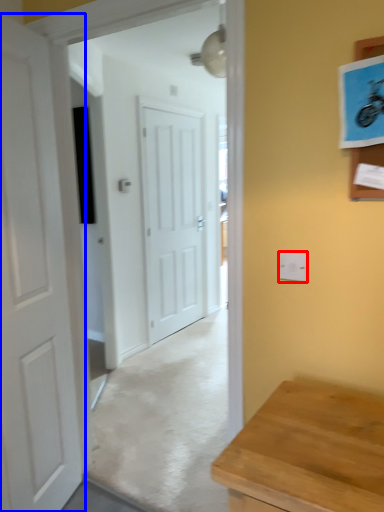
Question: Which point is further to the camera, electric outlet (highlighted by a red box) or door (highlighted by a blue box)?

Choices:
 (A) electric outlet
 (B) door

Answer: (A)